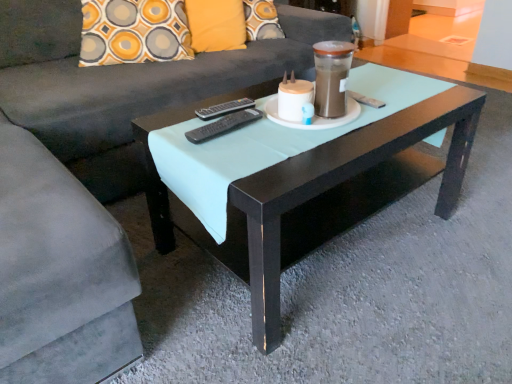
What do you see at coordinates (92, 179) in the screenshot?
I see `suede gray couch at center` at bounding box center [92, 179].

Identify the location of transparent glass beverage at center. (331, 77).

The image size is (512, 384). Find the location of `black plastic remote at center, which is counted as the second remote, starting from the back`. black plastic remote at center, which is counted as the second remote, starting from the back is located at coordinates (224, 125).

The height and width of the screenshot is (384, 512). I want to click on remote that is the 2nd one when counting downward from the transparent glass beverage at center (from the image's perspective), so click(x=224, y=125).

Considering the sizes of objects black plastic remote at center, which is counted as the second remote, starting from the back, and transparent glass beverage at center in the image provided, who is smaller, black plastic remote at center, which is counted as the second remote, starting from the back, or transparent glass beverage at center?

With smaller size is black plastic remote at center, which is counted as the second remote, starting from the back.

Does black plastic remote at center, the first remote in the front-to-back sequence, appear on the left side of transparent glass beverage at center?

Correct, you'll find black plastic remote at center, the first remote in the front-to-back sequence, to the left of transparent glass beverage at center.

From the image's perspective, relative to transparent glass beverage at center, is black plastic remote at center, which is counted as the second remote, starting from the back, above or below?

Based on their image positions, black plastic remote at center, which is counted as the second remote, starting from the back, is located beneath transparent glass beverage at center.

Is point (123, 268) closer to viewer compared to point (239, 119)?

Yes, it is.

In the image, is suede gray couch at center positioned in front of or behind black plastic remote at center, which is counted as the second remote, starting from the back?

Clearly, suede gray couch at center is in front of black plastic remote at center, which is counted as the second remote, starting from the back.

Is suede gray couch at center thinner than black plastic remote at center, the first remote in the front-to-back sequence?

In fact, suede gray couch at center might be wider than black plastic remote at center, the first remote in the front-to-back sequence.

In the scene shown: From a real-world perspective, who is located higher, suede gray couch at center or black plastic remote at center, which is counted as the second remote, starting from the back?

From a 3D spatial view, black plastic remote at center, which is counted as the second remote, starting from the back, is above.

Who is shorter, black plastic remote at center, the 1th remote in the back-to-front sequence, or suede gray couch at center?

black plastic remote at center, the 1th remote in the back-to-front sequence, is shorter.

Is point (214, 108) farther from viewer compared to point (63, 110)?

No, (214, 108) is closer to viewer.

From the suede gray couch at center, count 2nd remotes backward and point to it. Please provide its 2D coordinates.

[(224, 108)]

Between black plastic remote at center, the second remote viewed from the front, and suede gray couch at center, which one has larger size?

Bigger between the two is suede gray couch at center.

The height and width of the screenshot is (384, 512). Identify the location of remote that is the 1st object located behind the black matte coffee table at center. point(224,125).

Does black plastic remote at center, which is counted as the second remote, starting from the back, appear on the left side of black matte coffee table at center?

Yes.

How distant is black plastic remote at center, which is counted as the second remote, starting from the back, from black matte coffee table at center?

13.20 inches.

Considering the sizes of black plastic remote at center, the first remote in the front-to-back sequence, and black matte coffee table at center in the image, is black plastic remote at center, the first remote in the front-to-back sequence, taller or shorter than black matte coffee table at center?

In the image, black plastic remote at center, the first remote in the front-to-back sequence, appears to be shorter than black matte coffee table at center.

What are the coordinates of `coffee table below the suede gray couch at center (from the image's perspective)` in the screenshot? It's located at (312, 177).

Is the surface of black matte coffee table at center in direct contact with suede gray couch at center?

No.

Would you say black matte coffee table at center is to the left or to the right of suede gray couch at center in the picture?

From the image, it's evident that black matte coffee table at center is to the right of suede gray couch at center.

Relative to suede gray couch at center, is black matte coffee table at center in front or behind?

In the image, black matte coffee table at center appears behind suede gray couch at center.

In the image, is suede gray couch at center on the left side or the right side of transparent glass beverage at center?

From the image, it's evident that suede gray couch at center is to the left of transparent glass beverage at center.

Which is closer to the camera, (218, 87) or (324, 61)?

Point (218, 87) is farther from the camera than point (324, 61).

Consider the image. From the image's perspective, is suede gray couch at center located above or below transparent glass beverage at center?

From the image's perspective, suede gray couch at center appears above transparent glass beverage at center.

Where is `studio couch below the transparent glass beverage at center (from a real-world perspective)`? studio couch below the transparent glass beverage at center (from a real-world perspective) is located at coordinates (92, 179).

Between black plastic remote at center, the 1th remote in the back-to-front sequence, and transparent glass beverage at center, which one has smaller width?

black plastic remote at center, the 1th remote in the back-to-front sequence.

Based on their positions, is black plastic remote at center, the 1th remote in the back-to-front sequence, located to the left or right of transparent glass beverage at center?

black plastic remote at center, the 1th remote in the back-to-front sequence, is to the left of transparent glass beverage at center.

Based on the photo, is black plastic remote at center, the second remote viewed from the front, far away from transparent glass beverage at center?

No, black plastic remote at center, the second remote viewed from the front, is not far from transparent glass beverage at center.

Between black plastic remote at center, the second remote viewed from the front, and transparent glass beverage at center, which one has smaller size?

With smaller size is black plastic remote at center, the second remote viewed from the front.

Identify the location of beverage above the black plastic remote at center, the first remote in the front-to-back sequence (from a real-world perspective). (331, 77).

The width and height of the screenshot is (512, 384). In order to click on studio couch located above the black plastic remote at center, which is counted as the second remote, starting from the back (from the image's perspective) in this screenshot , I will do `click(92, 179)`.

Looking at the image, which one is located closer to black matte coffee table at center, suede gray couch at center or transparent glass beverage at center?

Based on the image, transparent glass beverage at center appears to be nearer to black matte coffee table at center.

Considering their positions, is black matte coffee table at center positioned further to suede gray couch at center than transparent glass beverage at center?

transparent glass beverage at center.

Based on their spatial positions, is transparent glass beverage at center or black matte coffee table at center closer to black plastic remote at center, the second remote viewed from the front?

The object closer to black plastic remote at center, the second remote viewed from the front, is transparent glass beverage at center.

From the image, which object appears to be farther from black plastic remote at center, the second remote viewed from the front, suede gray couch at center or black plastic remote at center, the first remote in the front-to-back sequence?

suede gray couch at center lies further to black plastic remote at center, the second remote viewed from the front, than the other object.

From the image, which object appears to be farther from suede gray couch at center, black matte coffee table at center or black plastic remote at center, the second remote viewed from the front?

black plastic remote at center, the second remote viewed from the front, is positioned further to the anchor suede gray couch at center.

Looking at the image, which one is located closer to black plastic remote at center, the second remote viewed from the front, transparent glass beverage at center or suede gray couch at center?

transparent glass beverage at center is closer to black plastic remote at center, the second remote viewed from the front.

Considering their positions, is black plastic remote at center, the 1th remote in the back-to-front sequence, positioned closer to black matte coffee table at center than black plastic remote at center, the first remote in the front-to-back sequence?

black plastic remote at center, the first remote in the front-to-back sequence, is closer to black matte coffee table at center.

Looking at the image, which one is located closer to black matte coffee table at center, transparent glass beverage at center or black plastic remote at center, the 1th remote in the back-to-front sequence?

transparent glass beverage at center is closer to black matte coffee table at center.

You are a GUI agent. You are given a task and a screenshot of the screen. Output one action in this format:
    pyautogui.click(x=<x>, y=<y>)
    Task: Click on the remote between suede gray couch at center and black plastic remote at center, the second remote viewed from the front, along the z-axis
    The height and width of the screenshot is (384, 512).
    Given the screenshot: What is the action you would take?
    pyautogui.click(x=224, y=125)

I want to click on coffee table located between suede gray couch at center and black plastic remote at center, the first remote in the front-to-back sequence, in the depth direction, so click(x=312, y=177).

You are a GUI agent. You are given a task and a screenshot of the screen. Output one action in this format:
    pyautogui.click(x=<x>, y=<y>)
    Task: Click on the beverage between suede gray couch at center and black plastic remote at center, which is counted as the second remote, starting from the back, along the z-axis
    The image size is (512, 384).
    Given the screenshot: What is the action you would take?
    pyautogui.click(x=331, y=77)

This screenshot has width=512, height=384. What are the coordinates of `coffee table located between suede gray couch at center and transparent glass beverage at center in the left-right direction` in the screenshot? It's located at (312, 177).